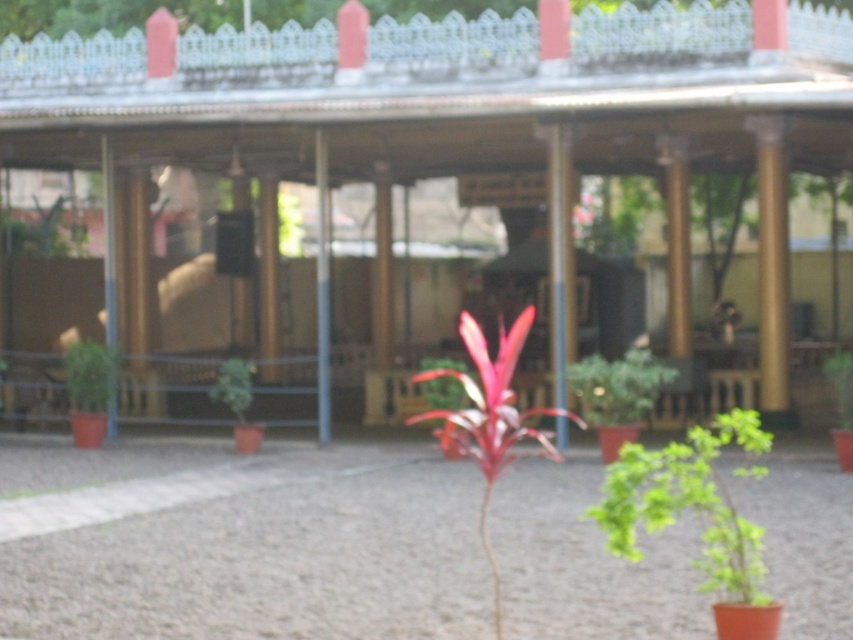
Consider the image. Measure the distance between green leafy plant at center and camera.

green leafy plant at center and camera are 69.69 feet apart.

At what (x,y) coordinates should I click in order to perform the action: click on green leafy plant at center. Please return your answer as a coordinate pair (x, y). Looking at the image, I should click on (618, 387).

Is green matte plant at lower right positioned before green matte plant at left?

Yes.

Is green matte plant at lower right smaller than green matte plant at left?

Indeed, green matte plant at lower right has a smaller size compared to green matte plant at left.

This screenshot has width=853, height=640. I want to click on green matte plant at lower right, so click(689, 502).

Which of these two, matte wood gazebo at center or green matte plant at upper left, stands taller?

Standing taller between the two is matte wood gazebo at center.

Between matte wood gazebo at center and green matte plant at upper left, which one appears on the right side from the viewer's perspective?

Positioned to the right is matte wood gazebo at center.

You are a GUI agent. You are given a task and a screenshot of the screen. Output one action in this format:
    pyautogui.click(x=<x>, y=<y>)
    Task: Click on the matte wood gazebo at center
    
    Given the screenshot: What is the action you would take?
    pyautogui.click(x=462, y=108)